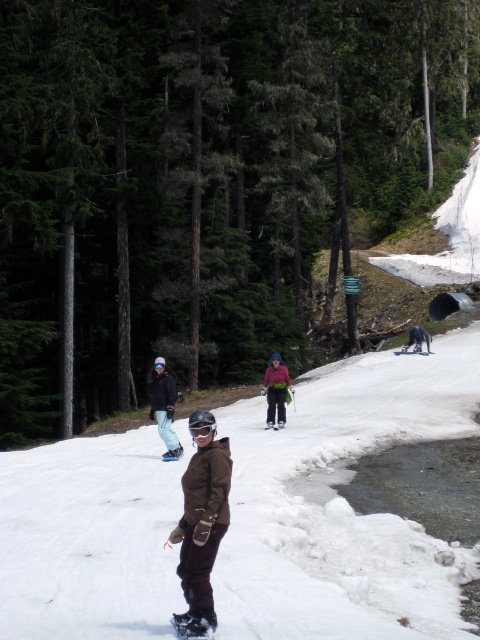
Consider the image. You are a photographer standing at the edge of the slope. You want to take a photo that includes both the brown snowboard at center and the matte pink jacket at center. What is the minimum distance you need to move backward to ensure both objects are in frame?

The minimum distance you need to move backward is 4.71 meters to ensure both the brown snowboard at center and the matte pink jacket at center are in frame.

You are a photographer trying to capture a photo of the matte pink jacket at center and the white matte snowboard at center. Since you want to focus on the snowboard, which object should you adjust your camera focus to prioritize, and why?

You should prioritize focusing on the white matte snowboard at center because the matte pink jacket at center is positioned under it, meaning the snowboard is closer to the camera and would be in focus first.

You are a photographer trying to capture a wide shot of the scene. The green matte tree at center and the dark blue snowboard at center are both in the frame. Which object would appear larger in the photo?

The green matte tree at center would appear larger in the photo because it is bigger than the dark blue snowboard at center.